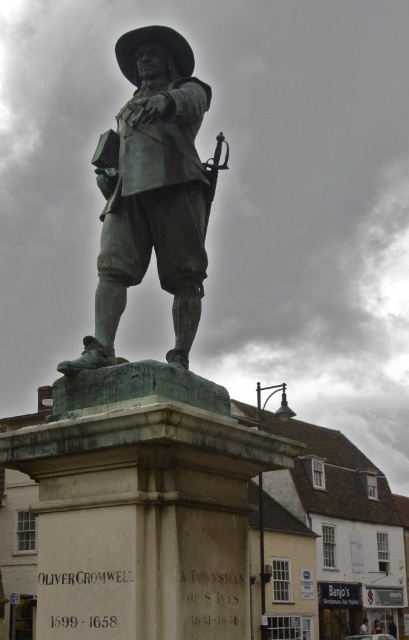
What is the spatial relationship between the bronze statue at center and the polished bronze rifle at upper center in the image?

The bronze statue at center is to the left of the polished bronze rifle at upper center.

You are a historian visiting the town square and want to compare the sizes of the bronze statue at center and the polished bronze rifle at upper center. Based on your observation, which object is bigger?

The bronze statue at center is larger in size compared to the polished bronze rifle at upper center.